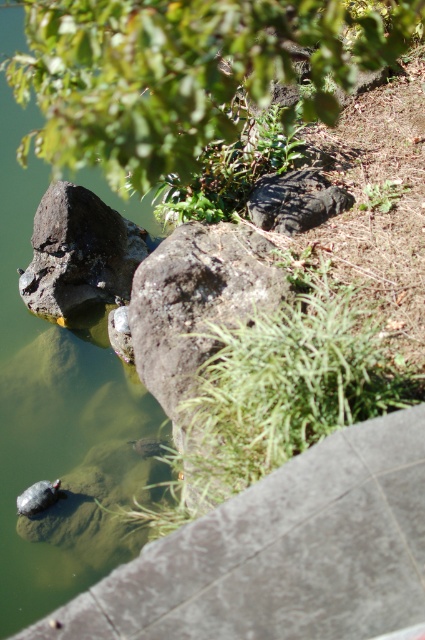
Is green leafy tree at upper center shorter than rough textured rock at left?

Incorrect, green leafy tree at upper center's height does not fall short of rough textured rock at left's.

Consider the image. Is green leafy tree at upper center to the right of rough textured rock at left from the viewer's perspective?

Indeed, green leafy tree at upper center is positioned on the right side of rough textured rock at left.

The width and height of the screenshot is (425, 640). What do you see at coordinates (184, 72) in the screenshot?
I see `green leafy tree at upper center` at bounding box center [184, 72].

Identify the location of green leafy tree at upper center. (184, 72).

Find the location of a particular element. green leafy tree at upper center is located at coordinates [x=184, y=72].

Is point (359, 1) closer to viewer compared to point (42, 611)?

That is False.

Locate an element on the screen. green leafy tree at upper center is located at coordinates (184, 72).

Is green stone water at left positioned at the back of rough textured rock at left?

No.

Is green stone water at left bigger than rough textured rock at left?

Correct, green stone water at left is larger in size than rough textured rock at left.

The width and height of the screenshot is (425, 640). I want to click on green stone water at left, so click(x=48, y=401).